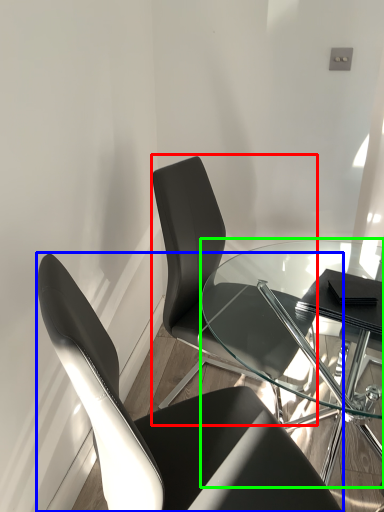
Question: Considering the real-world distances, which object is farthest from chair (highlighted by a red box)? chair (highlighted by a blue box) or table (highlighted by a green box)?

Choices:
 (A) chair
 (B) table

Answer: (A)